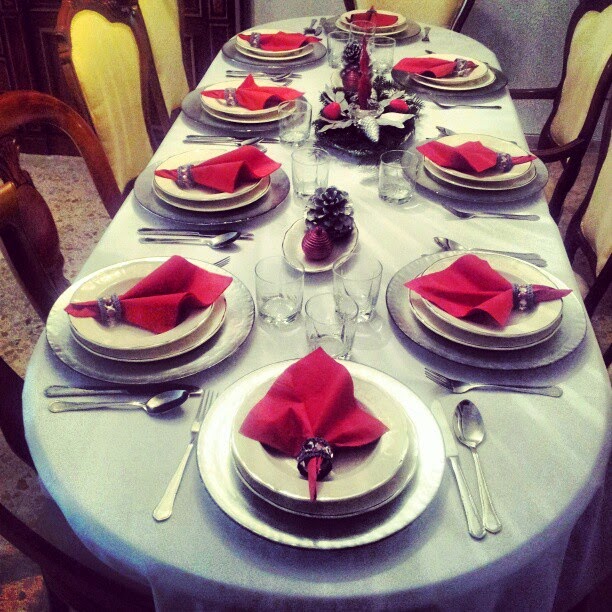
Locate an element on the screen. This screenshot has width=612, height=612. soup plates is located at coordinates (143, 334), (253, 453), (548, 318), (504, 144), (201, 196), (228, 106), (267, 49), (398, 16), (450, 79).